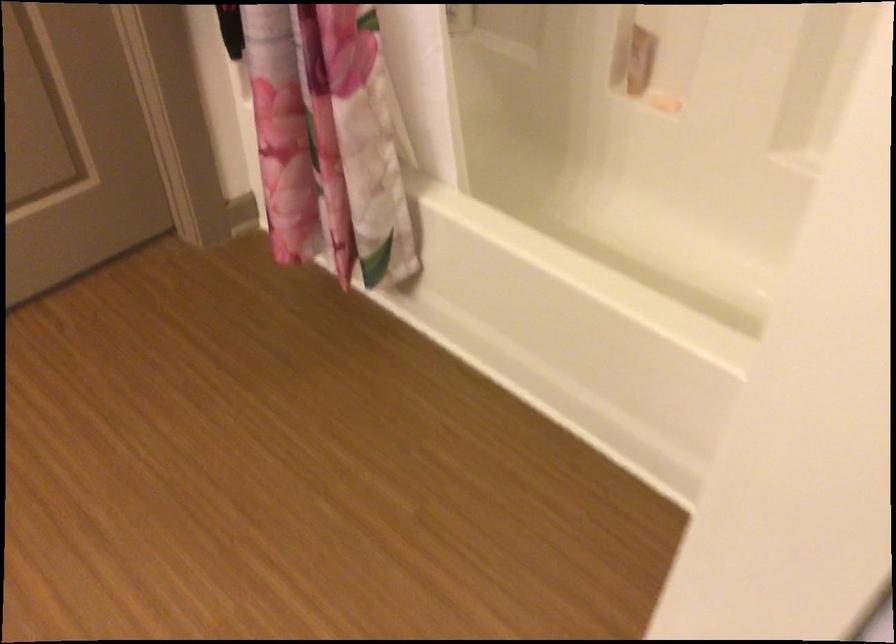
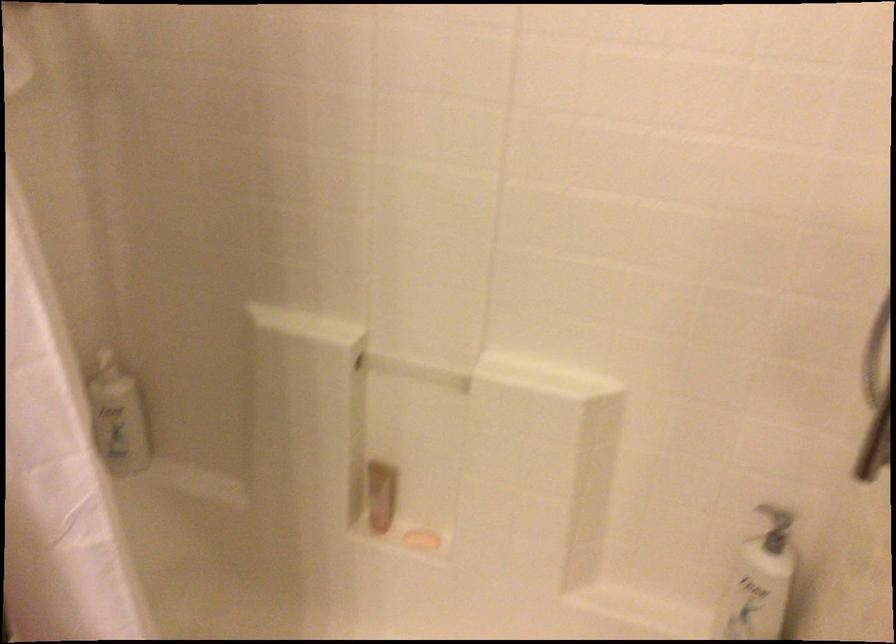
Question: How did the camera likely rotate?

Choices:
 (A) Left
 (B) Right
 (C) Up
 (D) Down

Answer: (B)